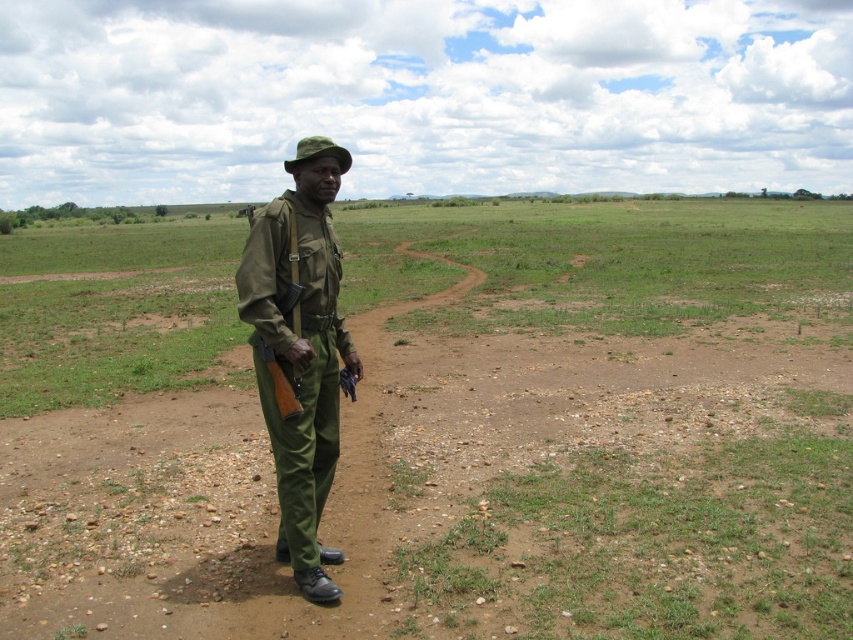
You are a drone operator trying to locate a specific point in the image. The point you need to find is at coordinates point (445, 428). Based on the scene description, where is this point likely located?

The point (445, 428) is on the green uniform at center.

You are a drone operator trying to navigate a drone between two points in the image. The points are labeled as point 1 at point (0, 417) and point 2 at point (308, 188). Based on their positions, which point is closer to you, the operator?

Point 1 at point (0, 417) is closer to you than point 2 at point (308, 188) because it is further to the viewer according to the description.